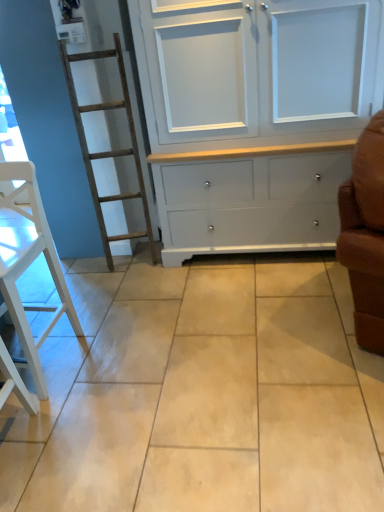
In order to click on free space in front of white painted wood cupboard at center in this screenshot , I will do [255, 320].